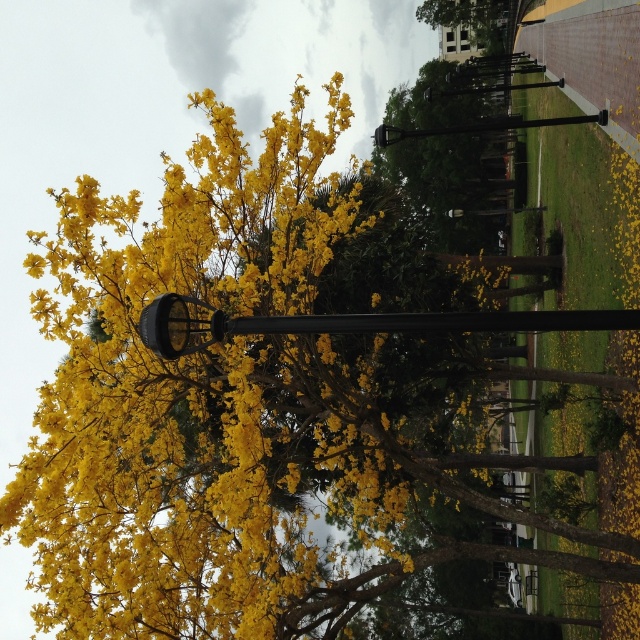
You are standing at the entrance of the park and see the black metal lamp post at center. If you walk straight ahead, will you reach the tree with bright yellow blossoms before the lamp post?

The black metal lamp post at center is located at point [348,323], so yes, you will reach the lamp post first before the tree with bright yellow blossoms if you walk straight ahead.

You are standing in the park and see the black metal lamp post at center and the black metal pole at center. Which one is positioned to the left?

The black metal lamp post at center is positioned to the left of the black metal pole at center.

You are a city planner assessing the spacing between the black metal lamp post at center and the black metal pole at center. Which one is smaller in size?

The black metal lamp post at center is smaller in size compared to the black metal pole at center.